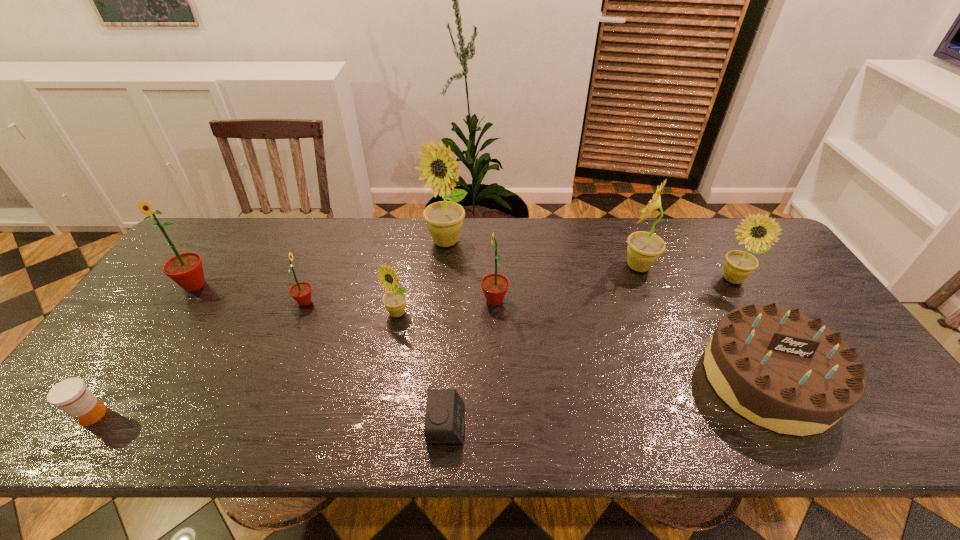
At what (x,y) coordinates should I click in order to perform the action: click on free space between the ninth tallest object and the second green sunflower from left to right. Please return your answer as a coordinate pair (x, y). The height and width of the screenshot is (540, 960). Looking at the image, I should click on (199, 359).

Where is `empty location between the fifth sunflower from left to right and the biggest green sunflower`? empty location between the fifth sunflower from left to right and the biggest green sunflower is located at coordinates click(345, 293).

In order to click on empty location between the second shortest object and the biggest green sunflower in this screenshot , I will do `click(144, 350)`.

Locate which object is the seventh closest to the alarm clock. Please provide its 2D coordinates. Your answer should be formatted as a tuple, i.e. [(x, y)], where the tuple contains the x and y coordinates of a point satisfying the conditions above.

[(71, 395)]

Find the location of a particular element. This screenshot has height=540, width=960. object identified as the third closest to the smallest yellow sunflower is located at coordinates (444, 219).

Identify the location of the closest sunflower to the second biggest green sunflower. (444, 219).

Identify which sunflower is the fifth closest to the second sunflower from right to left. Please provide its 2D coordinates. Your answer should be formatted as a tuple, i.e. [(x, y)], where the tuple contains the x and y coordinates of a point satisfying the conditions above.

[(301, 292)]

Choose which yellow sunflower is the nearest neighbor to the second sunflower from right to left. Please provide its 2D coordinates. Your answer should be formatted as a tuple, i.e. [(x, y)], where the tuple contains the x and y coordinates of a point satisfying the conditions above.

[(738, 265)]

Find the location of `yellow sunflower that stands as the third closest to the biggest yellow sunflower`. yellow sunflower that stands as the third closest to the biggest yellow sunflower is located at coordinates (738, 265).

Choose which green sunflower is the second nearest neighbor to the birthday cake. Please provide its 2D coordinates. Your answer should be formatted as a tuple, i.e. [(x, y)], where the tuple contains the x and y coordinates of a point satisfying the conditions above.

[(301, 292)]